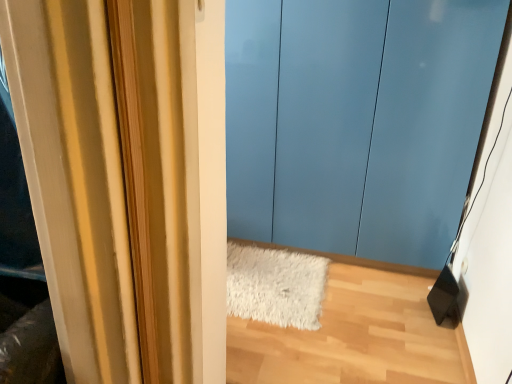
Question: Are white shaggy rug at lower center and glossy blue door at center located far from each other?

Choices:
 (A) yes
 (B) no

Answer: (B)

Question: Is white shaggy rug at lower center at the right side of glossy blue door at center?

Choices:
 (A) no
 (B) yes

Answer: (A)

Question: Does white shaggy rug at lower center have a lesser width compared to glossy blue door at center?

Choices:
 (A) no
 (B) yes

Answer: (A)

Question: From a real-world perspective, is white shaggy rug at lower center located beneath glossy blue door at center?

Choices:
 (A) no
 (B) yes

Answer: (B)

Question: Can you confirm if white shaggy rug at lower center is smaller than glossy blue door at center?

Choices:
 (A) yes
 (B) no

Answer: (A)

Question: Does white shaggy rug at lower center have a lesser height compared to glossy blue door at center?

Choices:
 (A) yes
 (B) no

Answer: (A)

Question: From a real-world perspective, is glossy blue door at center over white shaggy rug at lower center?

Choices:
 (A) yes
 (B) no

Answer: (A)

Question: Can you confirm if glossy blue door at center is positioned to the right of white shaggy rug at lower center?

Choices:
 (A) no
 (B) yes

Answer: (B)

Question: Is glossy blue door at center taller than white shaggy rug at lower center?

Choices:
 (A) no
 (B) yes

Answer: (B)

Question: Could you tell me if glossy blue door at center is facing white shaggy rug at lower center?

Choices:
 (A) no
 (B) yes

Answer: (B)

Question: Is the depth of glossy blue door at center greater than that of white shaggy rug at lower center?

Choices:
 (A) yes
 (B) no

Answer: (B)

Question: Is glossy blue door at center positioned far away from white shaggy rug at lower center?

Choices:
 (A) no
 (B) yes

Answer: (A)

Question: Does point (280, 177) appear closer or farther from the camera than point (322, 269)?

Choices:
 (A) farther
 (B) closer

Answer: (B)